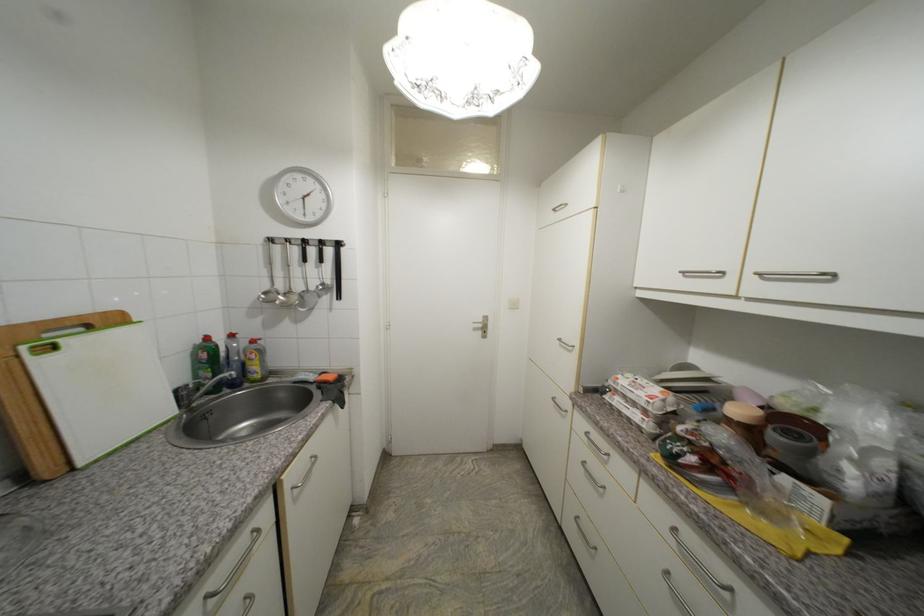
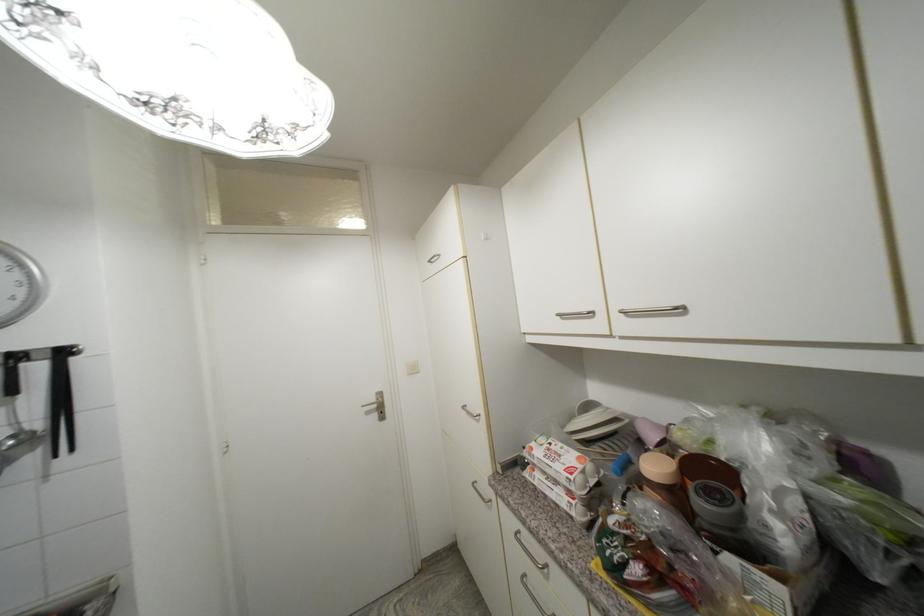
Where in the second image is the point corresponding to point 724,274 from the first image?

(594, 314)